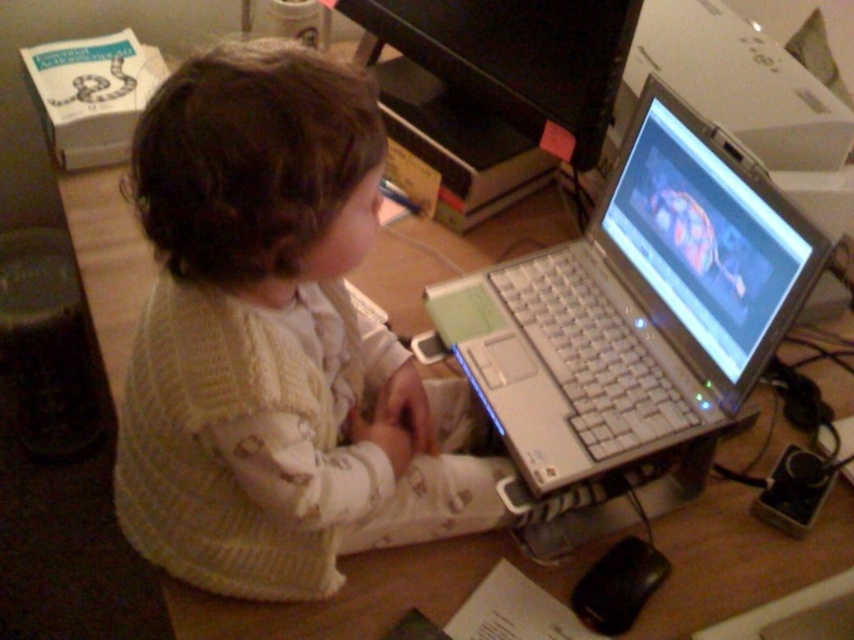
Question: Can you confirm if white knitted sweater at center is smaller than silver metallic laptop at center?

Choices:
 (A) yes
 (B) no

Answer: (B)

Question: Which of the following is the farthest from the observer?

Choices:
 (A) (542, 346)
 (B) (208, 422)

Answer: (A)

Question: Is white knitted sweater at center to the left of silver metallic laptop at center from the viewer's perspective?

Choices:
 (A) no
 (B) yes

Answer: (B)

Question: Which point is closer to the camera?

Choices:
 (A) (623, 376)
 (B) (173, 132)

Answer: (B)

Question: Which object is farther from the camera taking this photo?

Choices:
 (A) silver metallic laptop at center
 (B) white knitted sweater at center

Answer: (A)

Question: Is white knitted sweater at center closer to the viewer compared to silver metallic laptop at center?

Choices:
 (A) no
 (B) yes

Answer: (B)